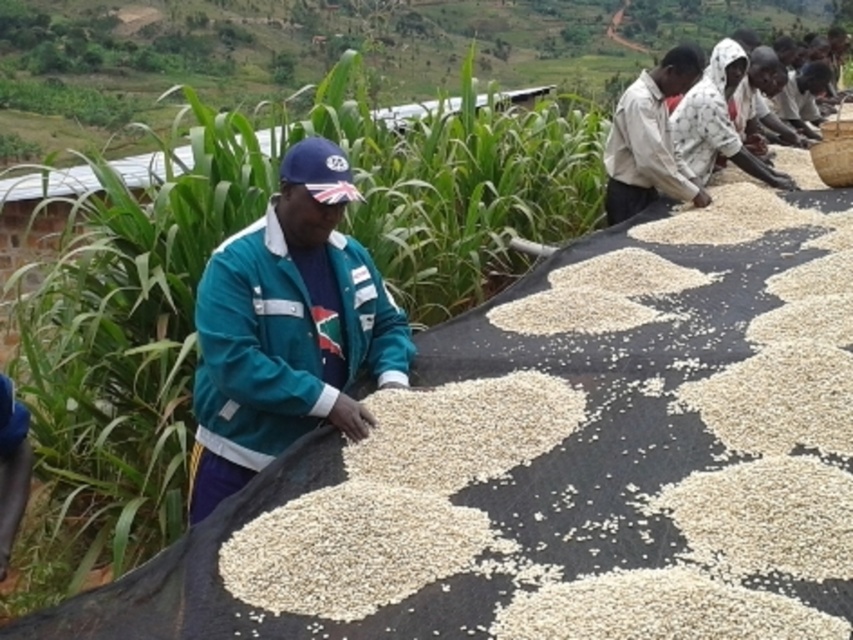
I want to click on teal fabric jacket at center, so click(287, 328).

Looking at this image, does teal fabric jacket at center appear under light brown cotton shirt at upper right?

Indeed, teal fabric jacket at center is positioned under light brown cotton shirt at upper right.

Does point (238, 467) lie in front of point (689, 80)?

Yes, point (238, 467) is closer to viewer.

Identify the location of teal fabric jacket at center. (287, 328).